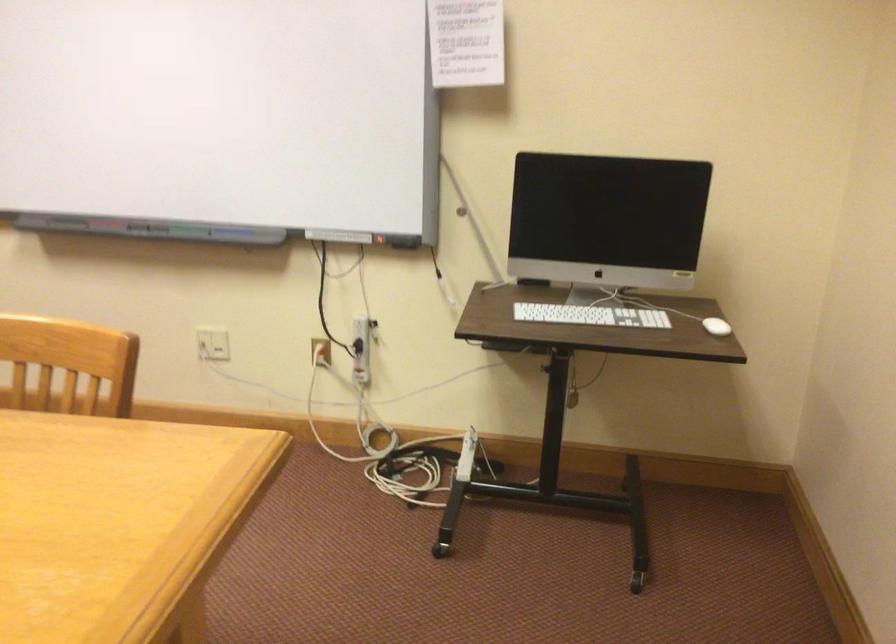
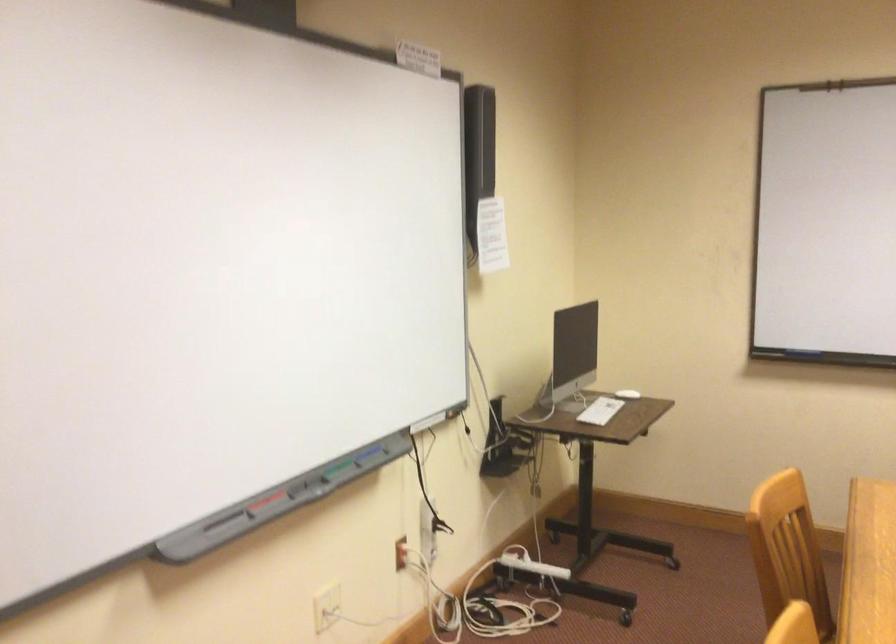
Where in the second image is the point corresponding to point 110,223 from the first image?

(264, 502)